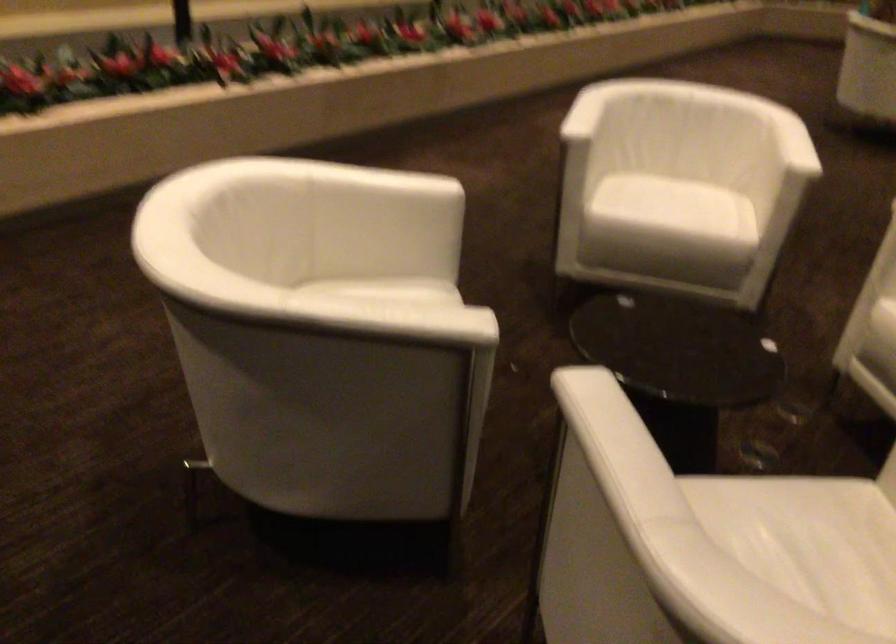
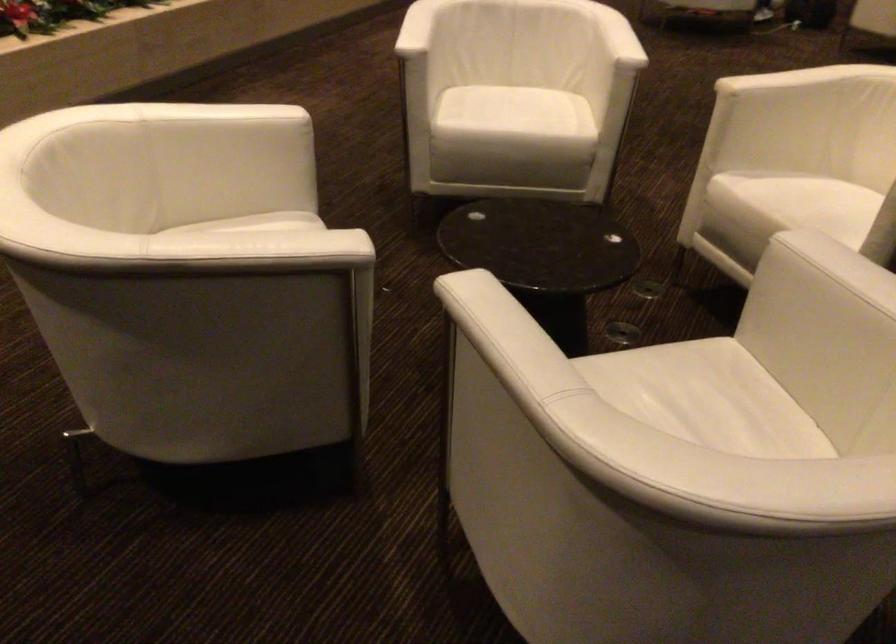
Question: How did the camera likely rotate?

Choices:
 (A) Left
 (B) Right
 (C) Up
 (D) Down

Answer: (B)